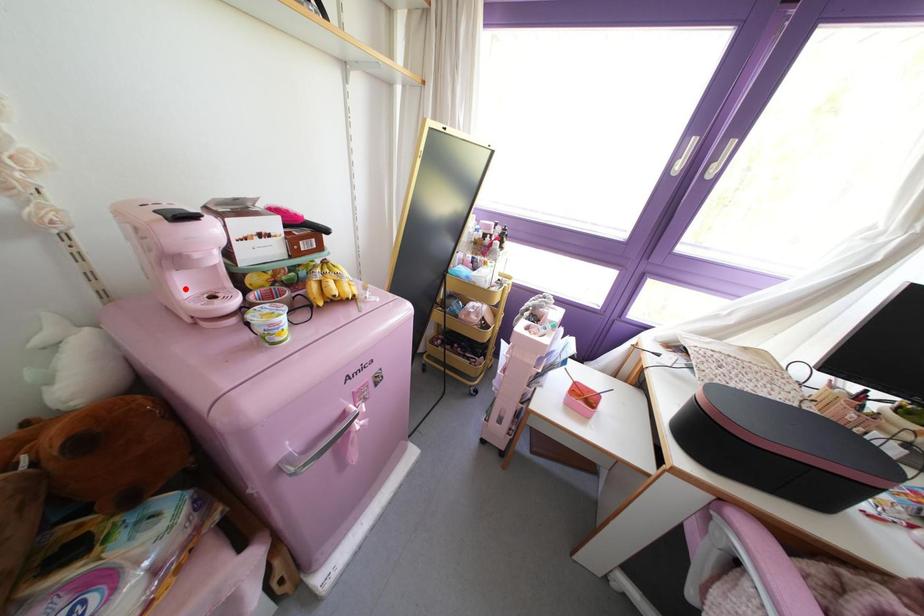
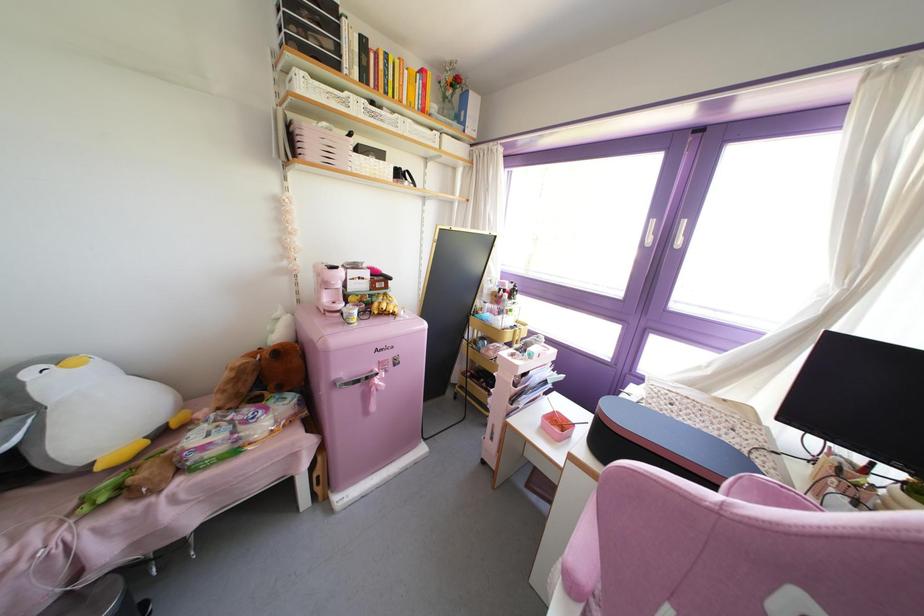
In the second image, find the point that corresponds to the highlighted location in the first image.

(324, 297)